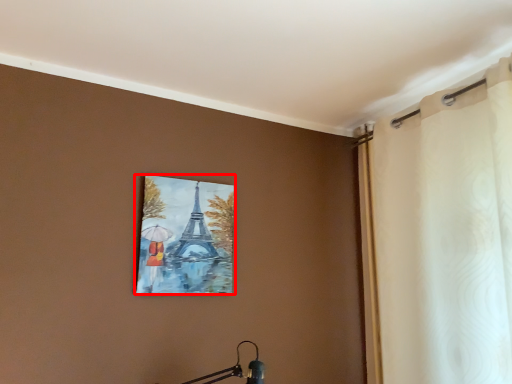
Question: In this image, where is picture frame (annotated by the red box) located relative to curtain?

Choices:
 (A) left
 (B) right

Answer: (A)